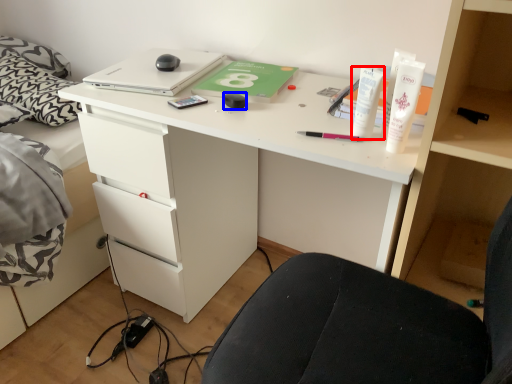
Question: Which point is further to the camera, toiletry (highlighted by a red box) or stationery (highlighted by a blue box)?

Choices:
 (A) toiletry
 (B) stationery

Answer: (B)